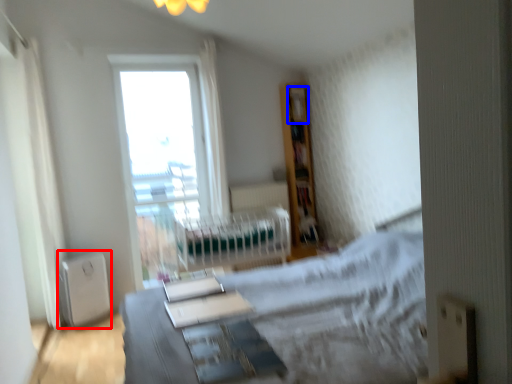
Question: Which object is further to the camera taking this photo, appliance (highlighted by a red box) or shelf (highlighted by a blue box)?

Choices:
 (A) appliance
 (B) shelf

Answer: (B)